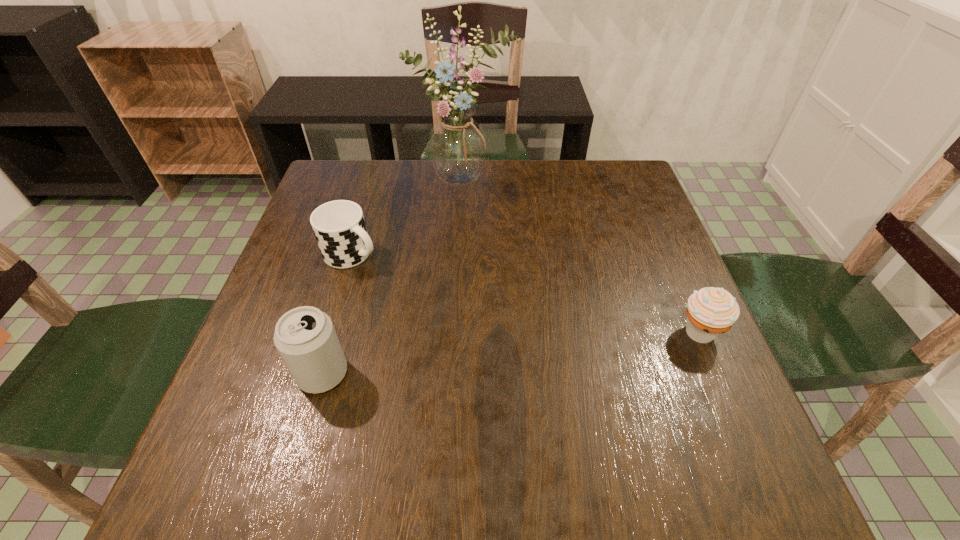
Identify the location of free space between the third shortest object and the third farthest object. (511, 353).

This screenshot has width=960, height=540. In order to click on vacant area that lies between the third shortest object and the muffin in this screenshot , I will do `click(511, 353)`.

The height and width of the screenshot is (540, 960). I want to click on free spot between the rightmost object and the third object from left to right, so click(581, 256).

Locate an element on the screen. This screenshot has width=960, height=540. empty location between the cup and the third farthest object is located at coordinates (525, 293).

Where is `blank region between the second nearest object and the bouquet`? This screenshot has height=540, width=960. blank region between the second nearest object and the bouquet is located at coordinates (581, 256).

You are a GUI agent. You are given a task and a screenshot of the screen. Output one action in this format:
    pyautogui.click(x=<x>, y=<y>)
    Task: Click on the free space between the third farthest object and the third nearest object
    
    Given the screenshot: What is the action you would take?
    pyautogui.click(x=525, y=293)

At what (x,y) coordinates should I click in order to perform the action: click on vacant area between the third object from left to right and the cup. Please return your answer as a coordinate pair (x, y). The width and height of the screenshot is (960, 540). Looking at the image, I should click on (408, 217).

Where is `object that stands as the second closest to the nearest object`? object that stands as the second closest to the nearest object is located at coordinates (457, 145).

Identify the location of object identified as the closest to the second object from right to left. This screenshot has width=960, height=540. (339, 227).

What are the coordinates of `vacant space that satisfies the following two spatial constraints: 1. on the back side of the rightmost object; 2. on the right side of the nearest object` in the screenshot? It's located at (334, 332).